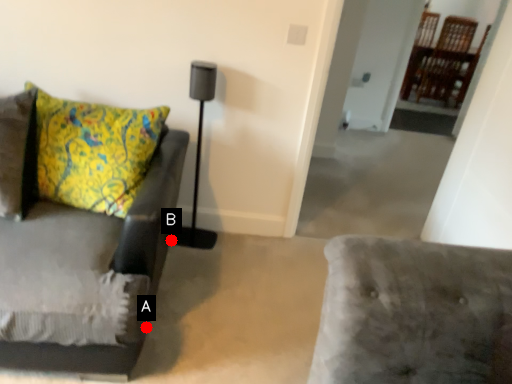
Question: Two points are circled on the image, labeled by A and B beside each circle. Which point appears closest to the camera in this image?

Choices:
 (A) A is closer
 (B) B is closer

Answer: (A)